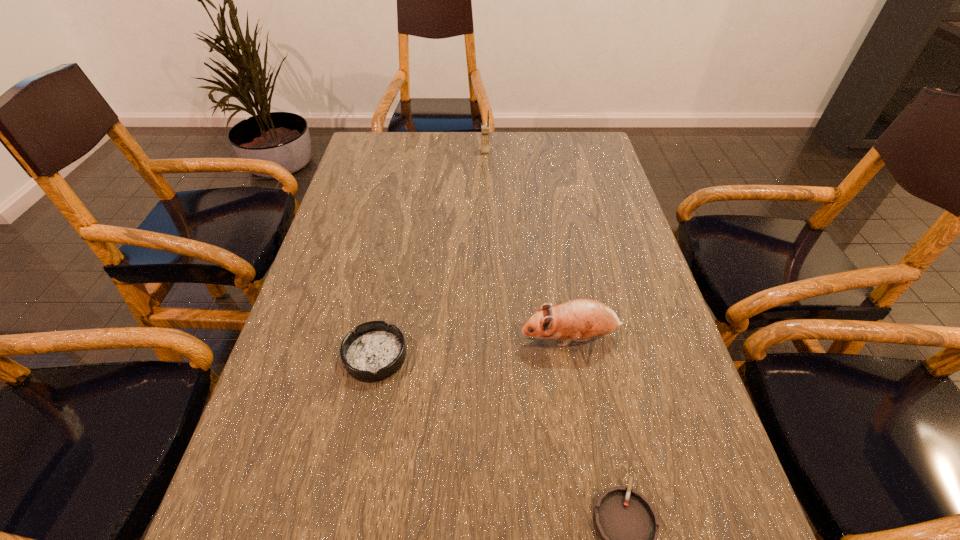
I want to click on object at the far edge, so click(x=484, y=128).

What are the coordinates of `object situated at the left edge` in the screenshot? It's located at (375, 350).

This screenshot has height=540, width=960. Find the location of `object at the right edge`. object at the right edge is located at coordinates (582, 319).

In the image, there is a desktop. Find the location of `vacant space at the far edge`. vacant space at the far edge is located at coordinates (502, 132).

The image size is (960, 540). What are the coordinates of `free space at the left edge` in the screenshot? It's located at (366, 316).

I want to click on free point at the right edge, so click(655, 444).

Locate an element on the screen. free spot between the taller ashtray and the third shortest object is located at coordinates (472, 347).

At what (x,y) coordinates should I click in order to perform the action: click on vacant area that lies between the third shortest object and the taller ashtray. Please return your answer as a coordinate pair (x, y). The height and width of the screenshot is (540, 960). Looking at the image, I should click on (472, 347).

Identify the location of free space between the tallest object and the hamster. (528, 245).

The height and width of the screenshot is (540, 960). I want to click on vacant area that lies between the third tallest object and the cellular telephone, so click(430, 254).